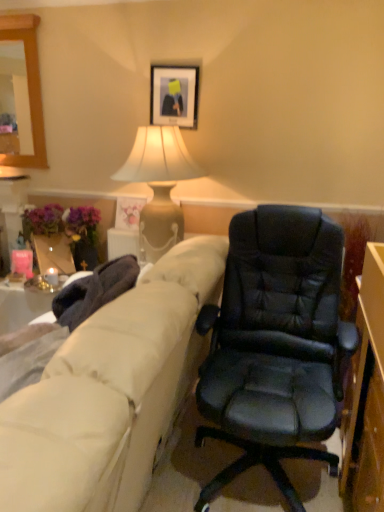
Question: Is matte beige lamp at upper center thinner than beige fabric couch at left?

Choices:
 (A) no
 (B) yes

Answer: (B)

Question: Could you tell me if matte beige lamp at upper center is facing beige fabric couch at left?

Choices:
 (A) no
 (B) yes

Answer: (B)

Question: Can you confirm if matte beige lamp at upper center is bigger than beige fabric couch at left?

Choices:
 (A) no
 (B) yes

Answer: (A)

Question: Would you say matte beige lamp at upper center is outside beige fabric couch at left?

Choices:
 (A) yes
 (B) no

Answer: (A)

Question: Does matte beige lamp at upper center have a smaller size compared to beige fabric couch at left?

Choices:
 (A) no
 (B) yes

Answer: (B)

Question: Considering the positions of black leather chair at center and matte beige lamp at upper center in the image, is black leather chair at center bigger or smaller than matte beige lamp at upper center?

Choices:
 (A) big
 (B) small

Answer: (B)

Question: Visually, is black leather chair at center positioned to the left or to the right of matte beige lamp at upper center?

Choices:
 (A) left
 (B) right

Answer: (B)

Question: From the image's perspective, is black leather chair at center located above or below matte beige lamp at upper center?

Choices:
 (A) below
 (B) above

Answer: (A)

Question: Considering the positions of point (231, 359) and point (160, 198), is point (231, 359) closer or farther from the camera than point (160, 198)?

Choices:
 (A) closer
 (B) farther

Answer: (A)

Question: Looking at the image, does beige fabric couch at left seem bigger or smaller compared to matte floral print picture frame at upper center, marked as the second picture frame in a front-to-back arrangement?

Choices:
 (A) small
 (B) big

Answer: (B)

Question: From the image's perspective, is beige fabric couch at left positioned above or below matte floral print picture frame at upper center, the 2th picture frame in the top-to-bottom sequence?

Choices:
 (A) above
 (B) below

Answer: (B)

Question: In the image, is beige fabric couch at left on the left side or the right side of matte floral print picture frame at upper center, positioned as the 2th picture frame in right-to-left order?

Choices:
 (A) right
 (B) left

Answer: (B)

Question: From a real-world perspective, is beige fabric couch at left above or below matte floral print picture frame at upper center, positioned as the 2th picture frame in right-to-left order?

Choices:
 (A) above
 (B) below

Answer: (B)

Question: Considering the positions of matte floral print picture frame at upper center, positioned as the first picture frame in bottom-to-top order, and black leather chair at center in the image, is matte floral print picture frame at upper center, positioned as the first picture frame in bottom-to-top order, wider or thinner than black leather chair at center?

Choices:
 (A) wide
 (B) thin

Answer: (B)

Question: Is matte floral print picture frame at upper center, marked as the second picture frame in a front-to-back arrangement, bigger or smaller than black leather chair at center?

Choices:
 (A) big
 (B) small

Answer: (B)